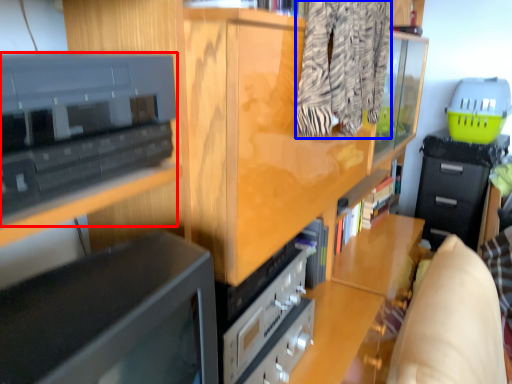
Question: Which of the following is the farthest to the observer, cabinetry (highlighted by a red box) or clothing (highlighted by a blue box)?

Choices:
 (A) cabinetry
 (B) clothing

Answer: (B)